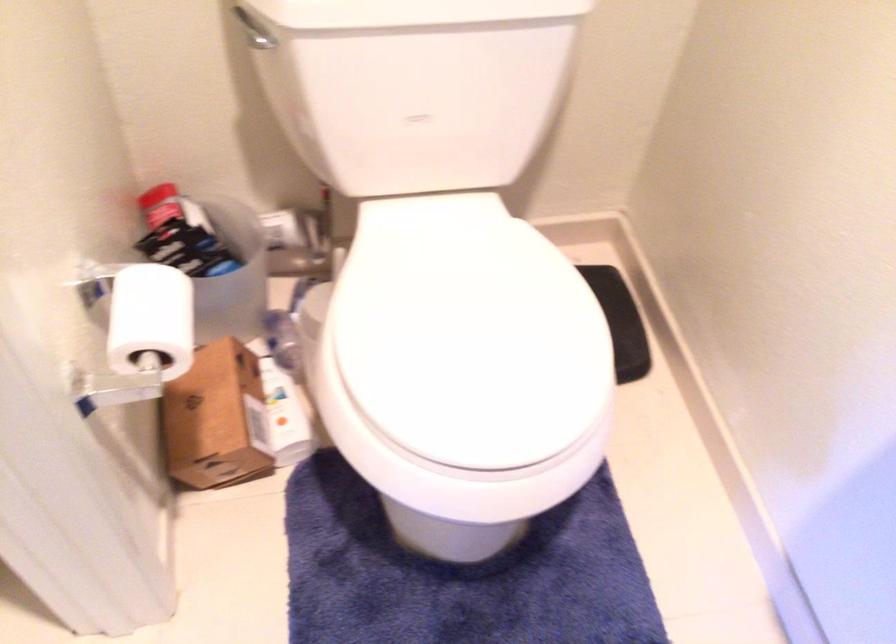
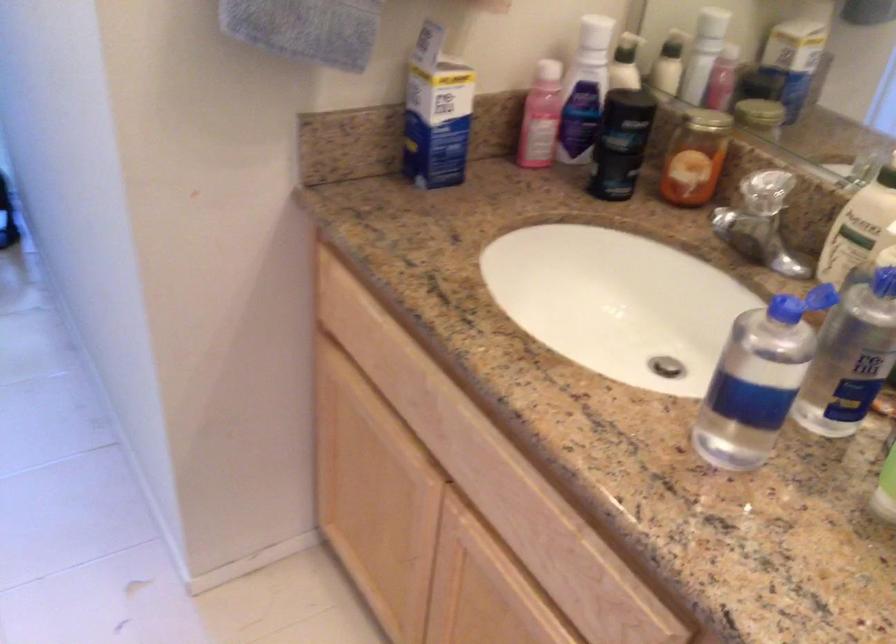
Question: The first image is from the beginning of the video and the second image is from the end. How did the camera likely rotate when shooting the video?

Choices:
 (A) Left
 (B) Right
 (C) Up
 (D) Down

Answer: (A)